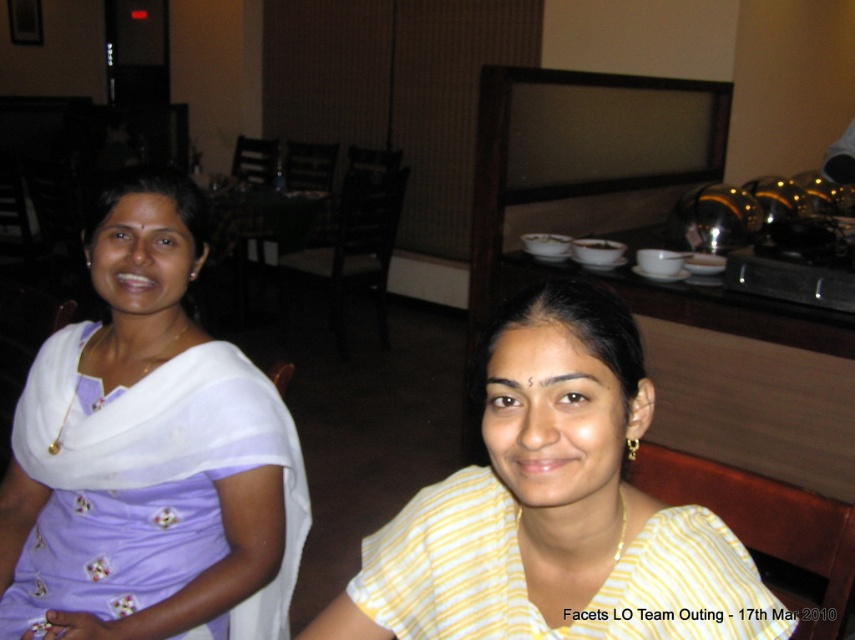
Locate an element on the screen. Image resolution: width=855 pixels, height=640 pixels. purple silk saree at left is located at coordinates (148, 452).

Can you confirm if purple silk saree at left is positioned to the left of yellow striped fabric at center?

Correct, you'll find purple silk saree at left to the left of yellow striped fabric at center.

Is point (118, 508) positioned after point (662, 637)?

Yes, it is.

Image resolution: width=855 pixels, height=640 pixels. I want to click on purple silk saree at left, so click(x=148, y=452).

Does point (546, 360) lie behind point (494, 540)?

No, it is in front of (494, 540).

Which is above, yellow striped blouse at center or yellow striped fabric at center?

Positioned higher is yellow striped blouse at center.

What do you see at coordinates (553, 506) in the screenshot?
I see `yellow striped blouse at center` at bounding box center [553, 506].

Where is `yellow striped blouse at center`? yellow striped blouse at center is located at coordinates (553, 506).

Does purple silk saree at left have a lesser width compared to yellow striped blouse at center?

No.

Can you confirm if purple silk saree at left is positioned to the right of yellow striped blouse at center?

No, purple silk saree at left is not to the right of yellow striped blouse at center.

Does point (287, 417) come farther from viewer compared to point (509, 524)?

Yes, point (287, 417) is behind point (509, 524).

Where is `purple silk saree at left`? The height and width of the screenshot is (640, 855). purple silk saree at left is located at coordinates (148, 452).